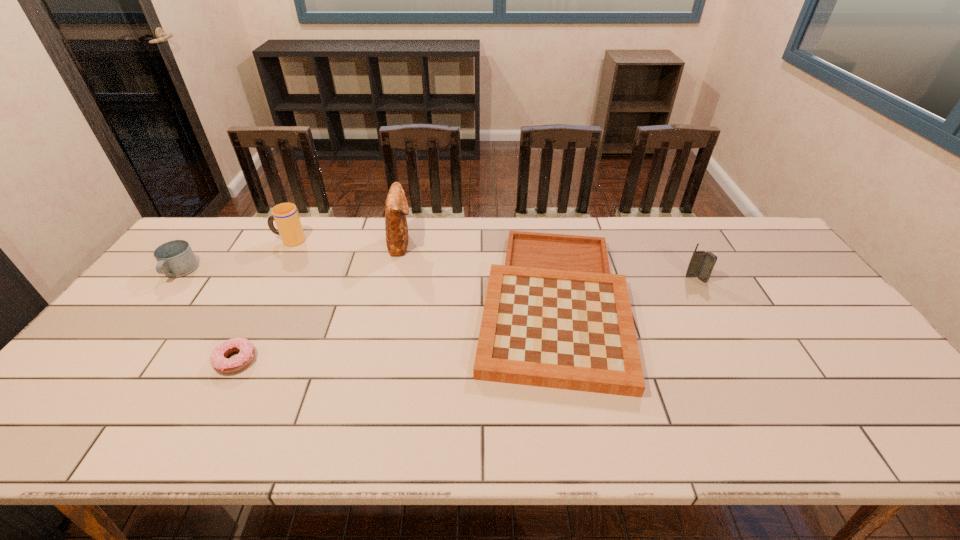
Find the location of a particular element. vacant space situated on the side of the cup with the handle is located at coordinates (211, 240).

Where is `free location located 0.080m on the side of the cup with the handle`? This screenshot has height=540, width=960. free location located 0.080m on the side of the cup with the handle is located at coordinates (250, 240).

Locate an element on the screen. vacant space located on the keyboard of the rightmost object is located at coordinates (707, 298).

You are a GUI agent. You are given a task and a screenshot of the screen. Output one action in this format:
    pyautogui.click(x=<x>, y=<y>)
    Task: Click on the vacant space located on the side of the mug with the handle
    
    Given the screenshot: What is the action you would take?
    pyautogui.click(x=111, y=357)

Locate an element on the screen. free spot located on the left of the gameboard is located at coordinates (391, 302).

Identify the location of vacant region located 0.140m on the right of the doughnut. (312, 360).

This screenshot has width=960, height=540. Identify the location of clutch bag at the far edge. (396, 208).

You are a GUI agent. You are given a task and a screenshot of the screen. Output one action in this format:
    pyautogui.click(x=<x>, y=<y>)
    Task: Click on the cup that is positioned at the far edge
    The image size is (960, 540).
    Given the screenshot: What is the action you would take?
    pyautogui.click(x=285, y=215)

Locate an element on the screen. mug situated at the far edge is located at coordinates (176, 258).

This screenshot has height=540, width=960. In order to click on gameboard at the far edge in this screenshot , I will do `click(554, 316)`.